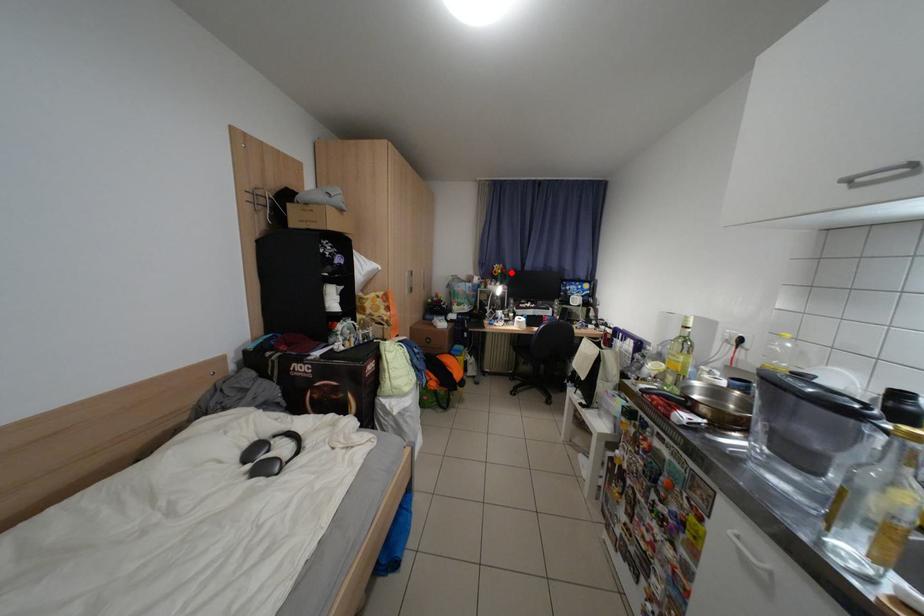
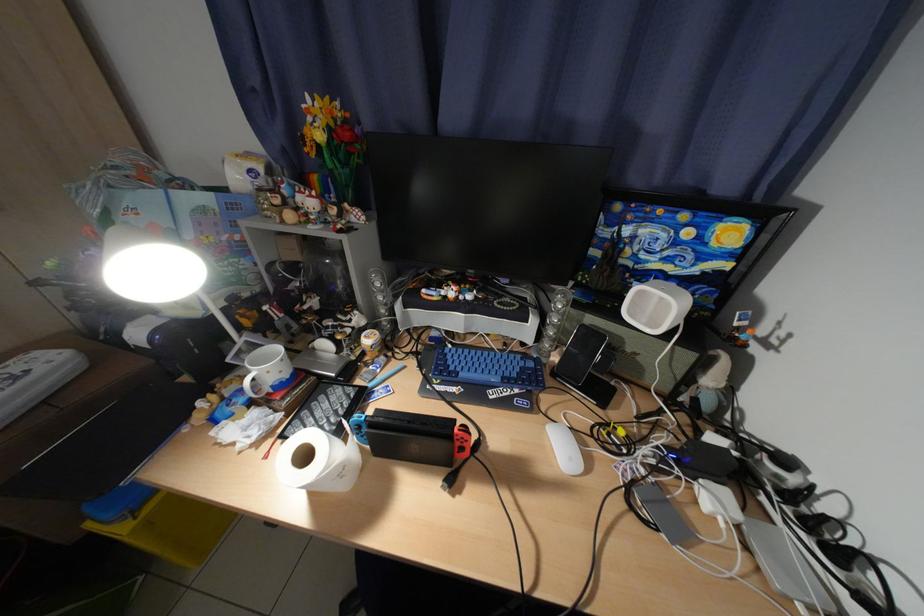
Where in the second image is the point corresponding to the highlighted location from the first image?

(331, 138)